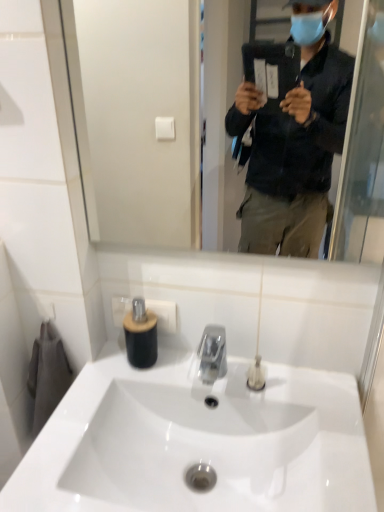
The height and width of the screenshot is (512, 384). What are the coordinates of `vacant area that is in front of black matte soap dispenser at center, which is counted as the 1th toiletry, starting from the left` in the screenshot? It's located at (110, 399).